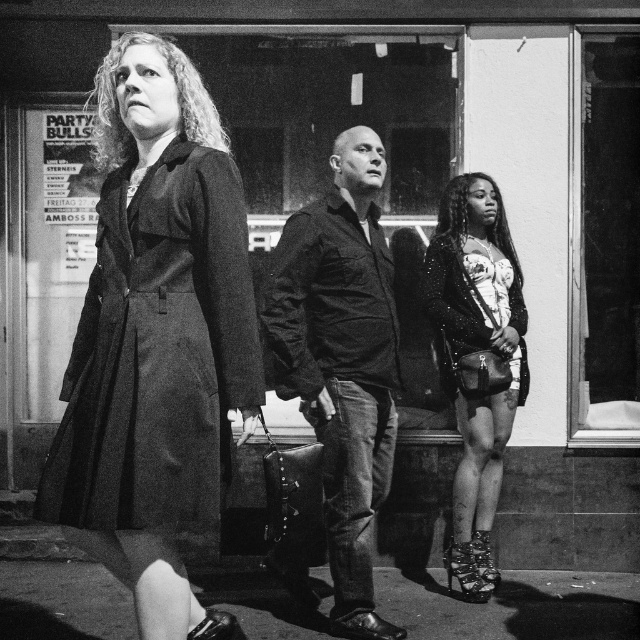
Can you confirm if leather jacket at center is bigger than shiny black pavement at lower center?

Correct, leather jacket at center is larger in size than shiny black pavement at lower center.

Who is positioned more to the left, leather jacket at center or shiny black pavement at lower center?

shiny black pavement at lower center

What do you see at coordinates (340, 362) in the screenshot? The image size is (640, 640). I see `leather jacket at center` at bounding box center [340, 362].

Where is `leather jacket at center`? leather jacket at center is located at coordinates (340, 362).

Is shiny black pavement at lower center above sparkly black dress at right?

Incorrect, shiny black pavement at lower center is not positioned above sparkly black dress at right.

The height and width of the screenshot is (640, 640). Describe the element at coordinates (515, 605) in the screenshot. I see `shiny black pavement at lower center` at that location.

Measure the distance between point (508,605) and camera.

Point (508,605) and camera are 15.35 feet apart from each other.

Identify the location of shiny black pavement at lower center. This screenshot has width=640, height=640. (515, 605).

Which is more to the right, leather jacket at center or sparkly black dress at right?

sparkly black dress at right is more to the right.

Between point (288, 236) and point (444, 285), which one is positioned in front?

Positioned in front is point (288, 236).

Where is `leather jacket at center`? leather jacket at center is located at coordinates (340, 362).